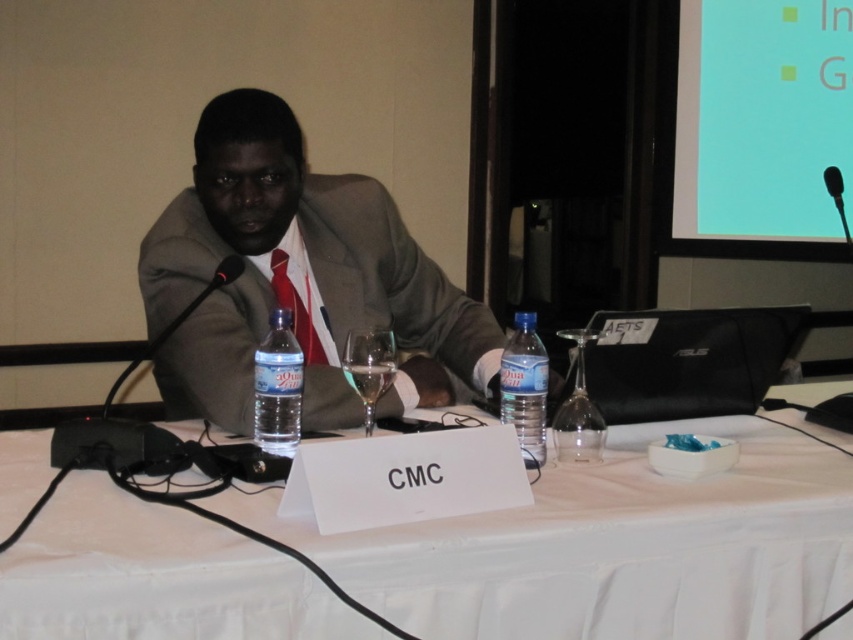
Question: Which object is farther from the camera taking this photo?

Choices:
 (A) blue plastic bottle at center
 (B) red silk tie at center
 (C) clear plastic water bottle at center
 (D) matte gray suit at center

Answer: (B)

Question: Among these objects, which one is farthest from the camera?

Choices:
 (A) red silk tie at center
 (B) clear plastic water bottle at center
 (C) blue plastic bottle at center
 (D) matte gray suit at center

Answer: (A)

Question: Which object is positioned farthest from the red silk tie at center?

Choices:
 (A) blue plastic bottle at center
 (B) matte gray suit at center
 (C) clear plastic water bottle at center
 (D) black plastic microphone at upper right

Answer: (D)

Question: Does white paper at center appear on the left side of matte gray suit at center?

Choices:
 (A) yes
 (B) no

Answer: (B)

Question: Can you confirm if matte gray suit at center is positioned to the right of black plastic microphone at upper right?

Choices:
 (A) yes
 (B) no

Answer: (B)

Question: In this image, where is blue plastic bottle at center located relative to red silk tie at center?

Choices:
 (A) right
 (B) left

Answer: (A)